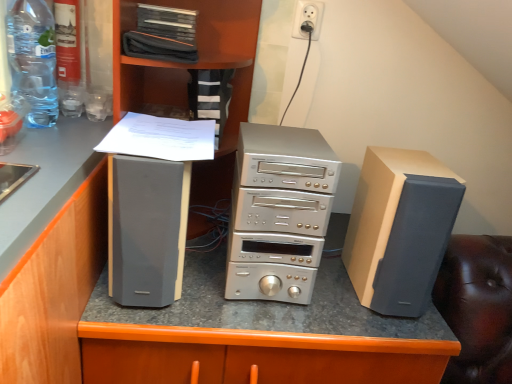
Locate an element on the screen. This screenshot has width=512, height=384. free location in front of transparent plastic bottle at upper left is located at coordinates tap(35, 147).